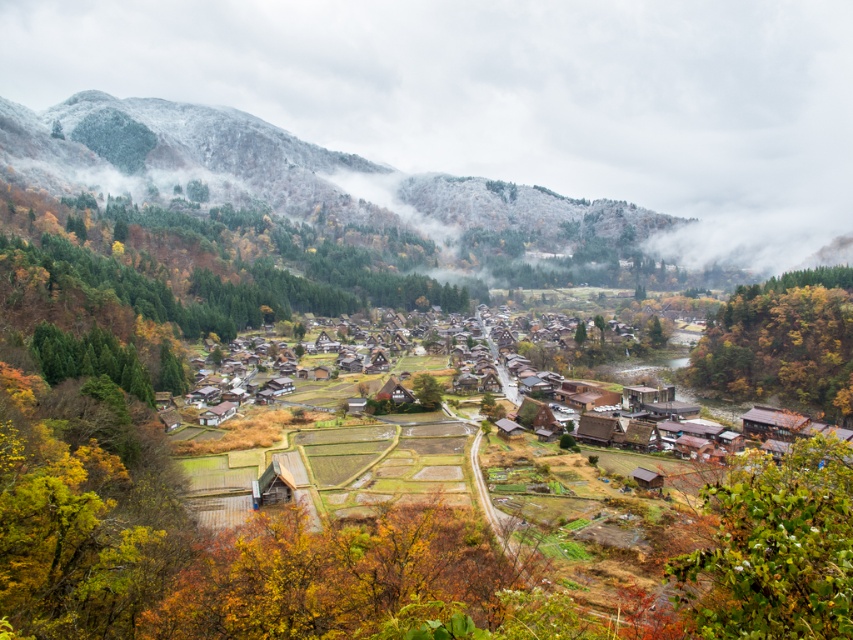
You are a visitor standing in the village and notice the green leafy tree at lower right and the autumn leaves at right. Which of these two has a greater height?

The autumn leaves at right are taller than the green leafy tree at lower right.